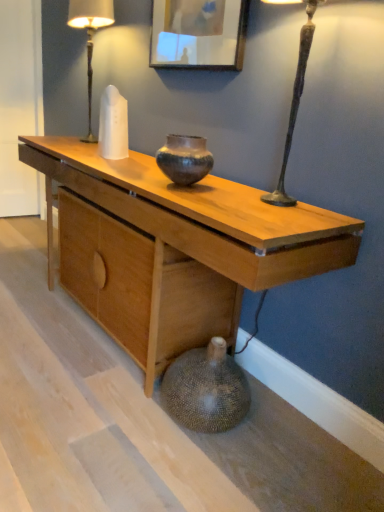
Locate an element on the screen. free space in front of earthy brown ceramic vase at center is located at coordinates (192, 195).